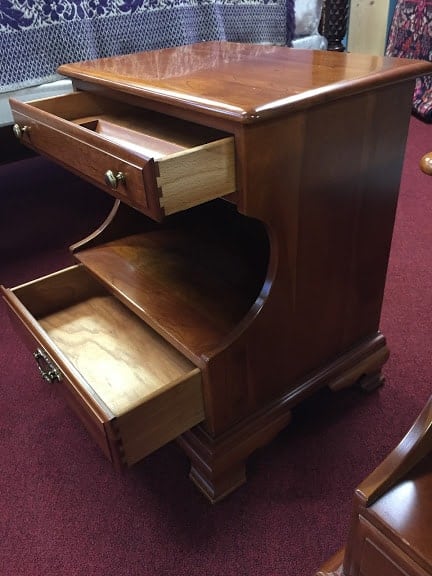
At what (x,y) coordinates should I click in order to perform the action: click on top drawer. Please return your answer as a coordinate pair (x, y). This screenshot has width=432, height=576. Looking at the image, I should click on (83, 147).